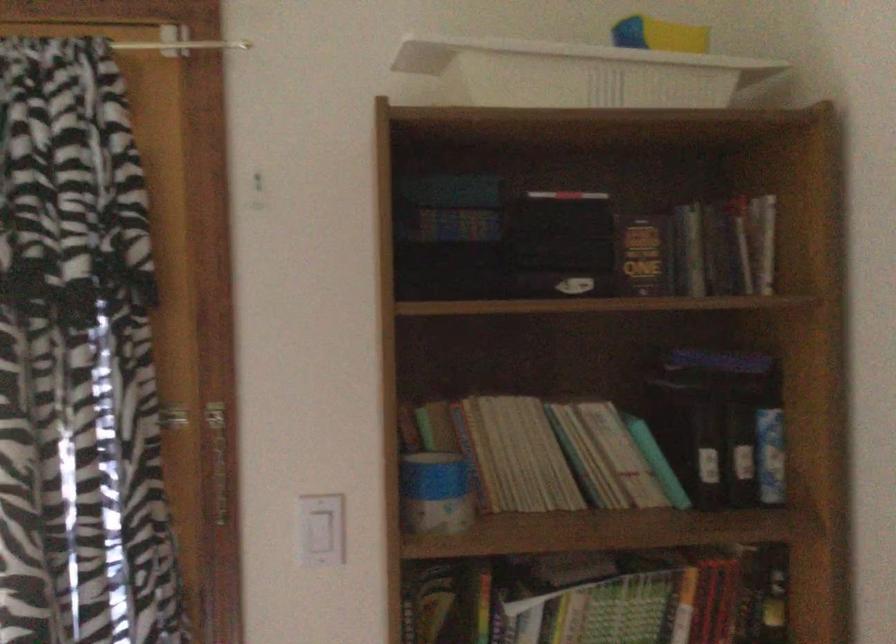
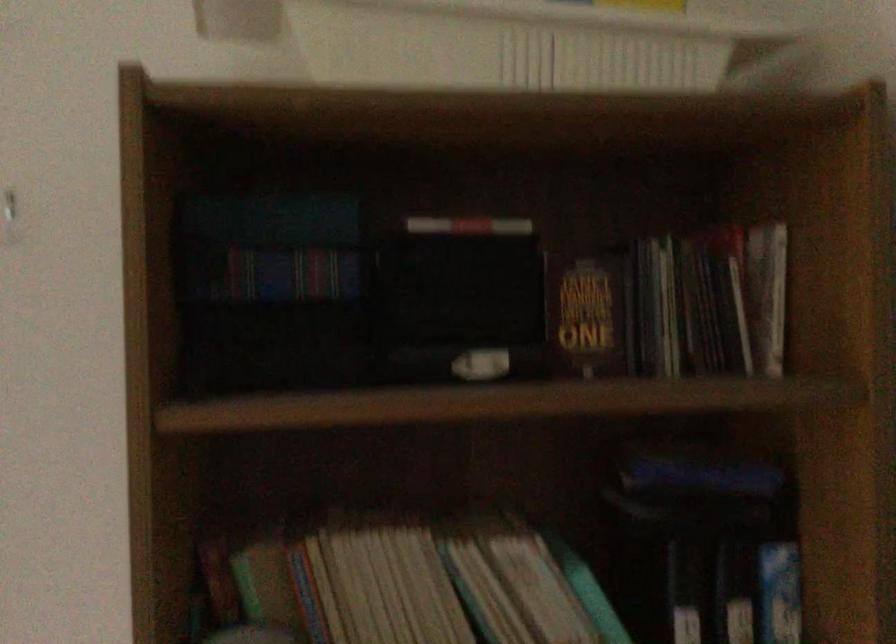
Question: The camera is either moving clockwise (left) or counter-clockwise (right) around the object. The first image is from the beginning of the video and the second image is from the end. Is the camera moving left or right when shooting the video?

Choices:
 (A) Left
 (B) Right

Answer: (A)